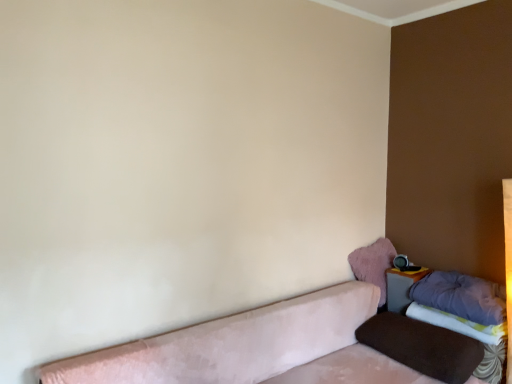
Question: Is velvet pink couch at lower left directly adjacent to purple soft pillow at right, the second pillow from the bottom?

Choices:
 (A) no
 (B) yes

Answer: (A)

Question: Does velvet pink couch at lower left contain purple soft pillow at right, arranged as the second pillow when viewed from the top?

Choices:
 (A) no
 (B) yes

Answer: (A)

Question: From a real-world perspective, is velvet pink couch at lower left located higher than purple soft pillow at right, the second pillow from the bottom?

Choices:
 (A) no
 (B) yes

Answer: (A)

Question: Considering the relative sizes of velvet pink couch at lower left and purple soft pillow at right, the second pillow from the bottom, in the image provided, is velvet pink couch at lower left thinner than purple soft pillow at right, the second pillow from the bottom,?

Choices:
 (A) yes
 (B) no

Answer: (B)

Question: Is velvet pink couch at lower left further to camera compared to purple soft pillow at right, arranged as the second pillow when viewed from the top?

Choices:
 (A) yes
 (B) no

Answer: (B)

Question: Considering the relative sizes of velvet pink couch at lower left and purple soft pillow at right, the second pillow from the bottom, in the image provided, is velvet pink couch at lower left taller than purple soft pillow at right, the second pillow from the bottom,?

Choices:
 (A) no
 (B) yes

Answer: (B)

Question: Is purple fabric sheet at lower right in front of brown velvety pillow at lower right, arranged as the 1th pillow when ordered from the bottom?

Choices:
 (A) yes
 (B) no

Answer: (B)

Question: Is purple fabric sheet at lower right thinner than brown velvety pillow at lower right, arranged as the 1th pillow when ordered from the bottom?

Choices:
 (A) no
 (B) yes

Answer: (B)

Question: Is purple fabric sheet at lower right oriented towards brown velvety pillow at lower right, arranged as the 1th pillow when ordered from the bottom?

Choices:
 (A) no
 (B) yes

Answer: (B)

Question: Can we say purple fabric sheet at lower right lies outside brown velvety pillow at lower right, arranged as the 1th pillow when ordered from the bottom?

Choices:
 (A) no
 (B) yes

Answer: (B)

Question: Is purple fabric sheet at lower right with brown velvety pillow at lower right, arranged as the 1th pillow when ordered from the bottom?

Choices:
 (A) no
 (B) yes

Answer: (A)

Question: Considering the relative sizes of purple fabric sheet at lower right and brown velvety pillow at lower right, which is the 3th pillow in top-to-bottom order, in the image provided, is purple fabric sheet at lower right wider than brown velvety pillow at lower right, which is the 3th pillow in top-to-bottom order,?

Choices:
 (A) yes
 (B) no

Answer: (B)

Question: Is brown velvety pillow at lower right, which is the 3th pillow in top-to-bottom order, positioned with its back to purple soft pillow at right, the second pillow from the bottom?

Choices:
 (A) no
 (B) yes

Answer: (A)